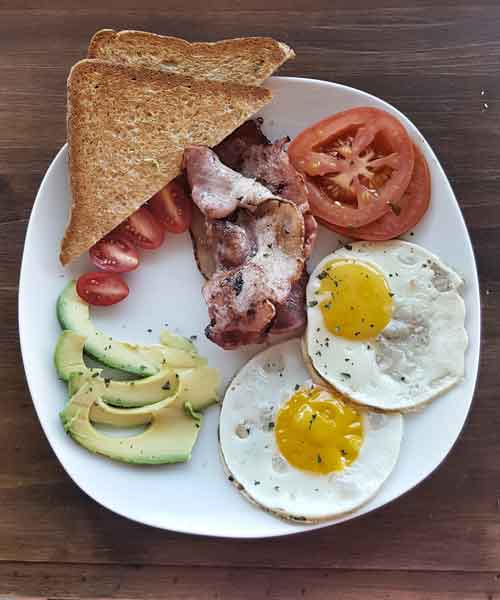
Find the location of a particular element. This screenshot has width=500, height=600. plate to put the food on is located at coordinates (175, 502).